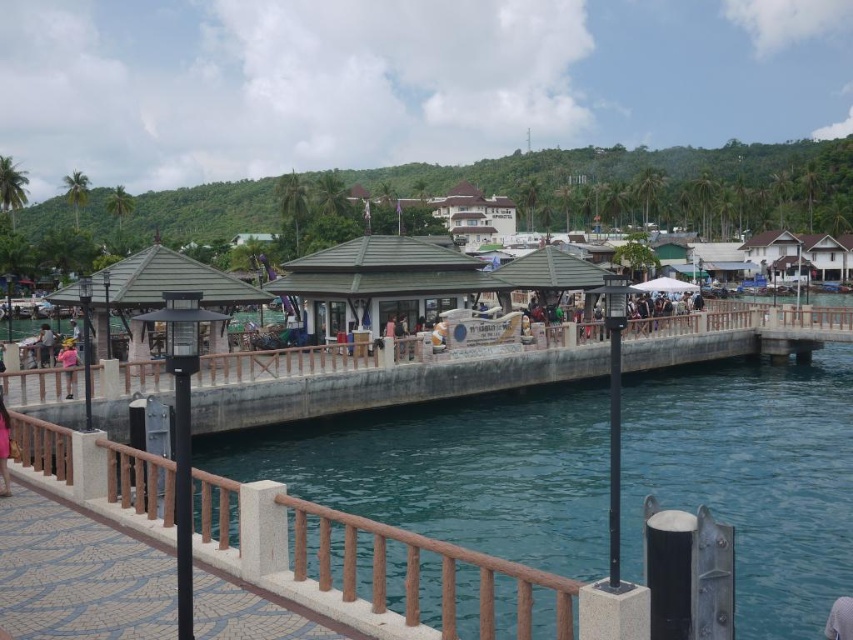
You are standing on the waterfront walkway and notice both the brown polished wood rail at lower center and the pink fabric at center. Which object is closer to you as you face the water?

The brown polished wood rail at lower center is closer to you because it is positioned in front of the pink fabric at center.